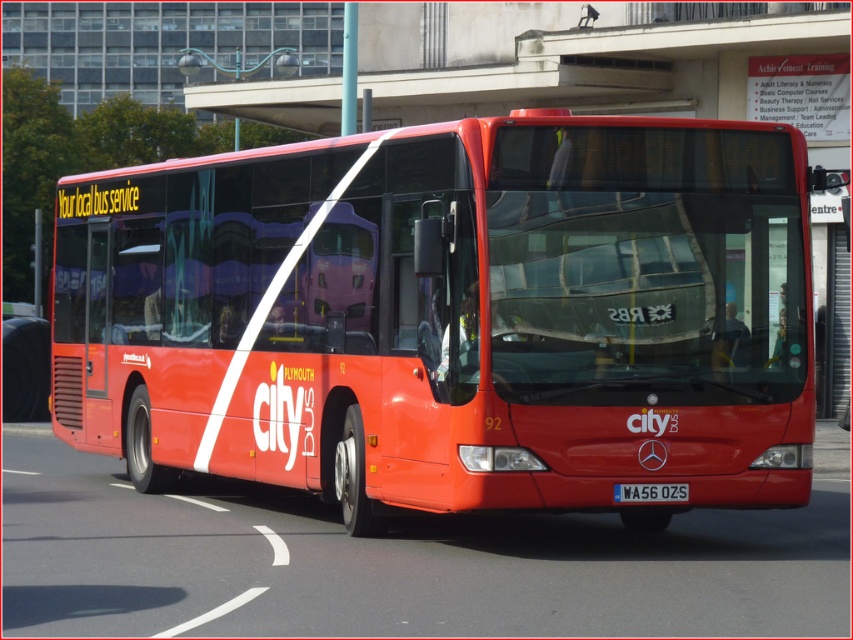
You are a photographer trying to capture the shiny red bus at center and the white plastic license plate at center in a single photo. Which object should you focus on first to ensure both are in frame?

The shiny red bus at center is much taller than the white plastic license plate at center, so you should focus on the shiny red bus at center first to ensure both are in frame.

Consider the image. You are standing at the center of the image. There is a shiny red bus at center. Where is the shiny red bus located relative to your position?

The shiny red bus at center is located exactly at your position since it is at the center of the image.